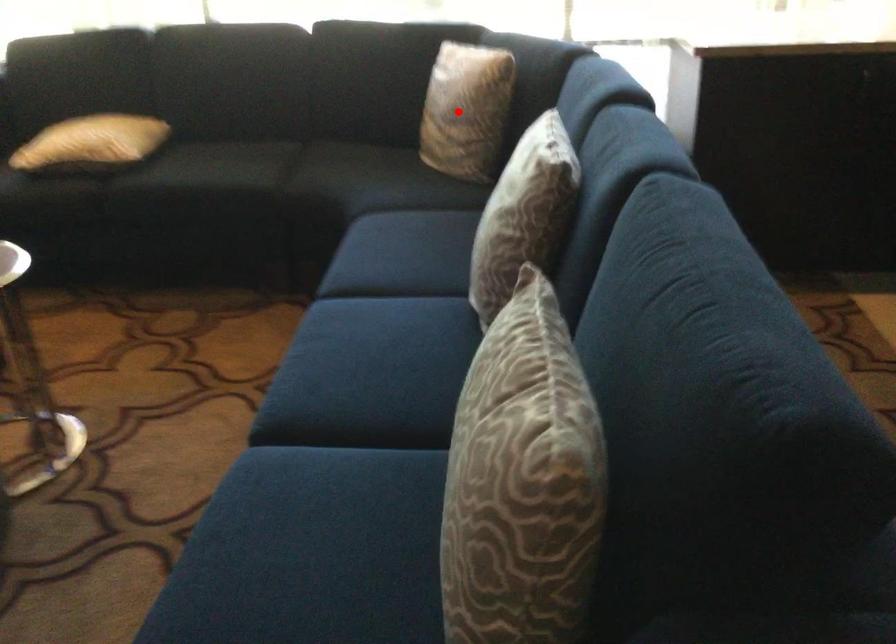
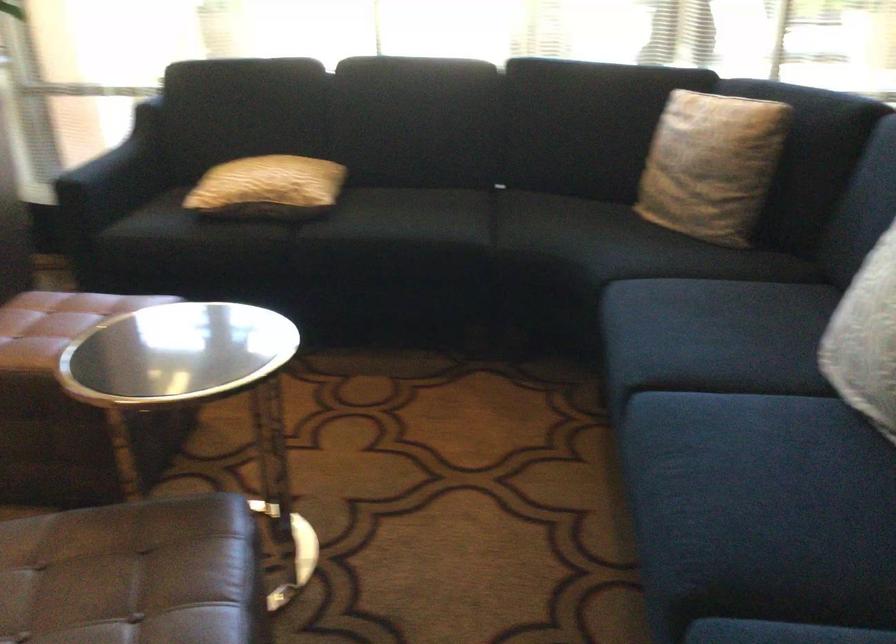
Find the pixel in the second image that matches the highlighted location in the first image.

(711, 165)